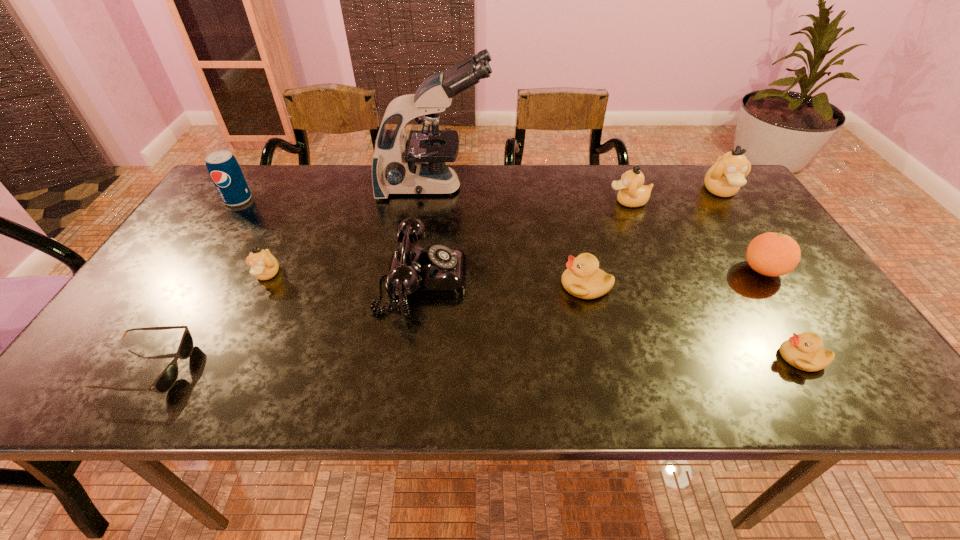
Locate an element on the screen. Image resolution: width=960 pixels, height=540 pixels. free space between the second shortest object and the sunglasses is located at coordinates (474, 363).

Locate an element on the screen. free point between the farther yellow duckling and the tallest object is located at coordinates (x=510, y=237).

The image size is (960, 540). What are the coordinates of `free space between the leftmost tan duckling and the microscope` in the screenshot? It's located at (350, 231).

In order to click on free space between the telephone and the leftmost duckling in this screenshot , I will do `click(345, 277)`.

This screenshot has width=960, height=540. What are the coordinates of `free space between the second tan duckling from left to right and the leftmost duckling` in the screenshot? It's located at (447, 238).

The width and height of the screenshot is (960, 540). Find the location of `object that is the ninth closest one to the second shortest object`. object that is the ninth closest one to the second shortest object is located at coordinates (225, 172).

At what (x,y) coordinates should I click in order to perform the action: click on the sixth closest object to the pop. Please return your answer as a coordinate pair (x, y). The width and height of the screenshot is (960, 540). Looking at the image, I should click on (632, 193).

Choose which duckling is the fifth nearest neighbor to the microscope. Please provide its 2D coordinates. Your answer should be formatted as a tuple, i.e. [(x, y)], where the tuple contains the x and y coordinates of a point satisfying the conditions above.

[(804, 351)]

The image size is (960, 540). I want to click on duckling object that ranks as the fourth closest to the blue pop, so pos(724,179).

Select which tan duckling is the second closest to the farther yellow duckling. Please provide its 2D coordinates. Your answer should be formatted as a tuple, i.e. [(x, y)], where the tuple contains the x and y coordinates of a point satisfying the conditions above.

[(724, 179)]